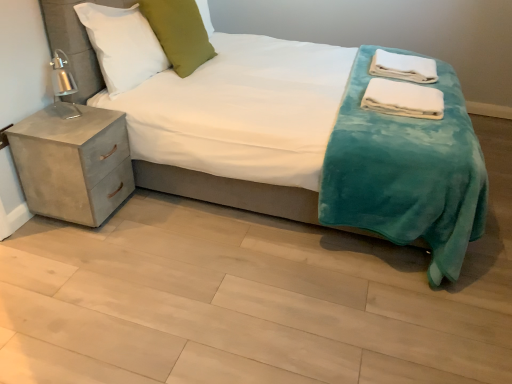
Where is `vacant area in front of concrete nightstand at left`? The width and height of the screenshot is (512, 384). vacant area in front of concrete nightstand at left is located at coordinates (70, 254).